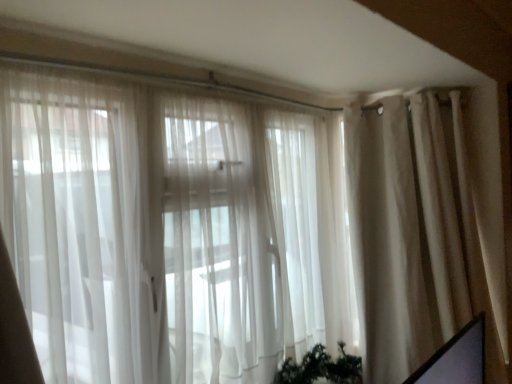
Question: From the image's perspective, does beige fabric curtain at right appear higher than matte black screen at lower right?

Choices:
 (A) yes
 (B) no

Answer: (A)

Question: Can you confirm if beige fabric curtain at right is positioned to the left of matte black screen at lower right?

Choices:
 (A) yes
 (B) no

Answer: (B)

Question: Does beige fabric curtain at right have a greater height compared to matte black screen at lower right?

Choices:
 (A) no
 (B) yes

Answer: (B)

Question: Can you confirm if beige fabric curtain at right is thinner than matte black screen at lower right?

Choices:
 (A) yes
 (B) no

Answer: (B)

Question: Does beige fabric curtain at right come behind matte black screen at lower right?

Choices:
 (A) no
 (B) yes

Answer: (B)

Question: Is beige fabric curtain at right directly adjacent to matte black screen at lower right?

Choices:
 (A) no
 (B) yes

Answer: (A)

Question: Is matte black screen at lower right in front of beige fabric curtain at right?

Choices:
 (A) yes
 (B) no

Answer: (A)

Question: Is matte black screen at lower right surrounding beige fabric curtain at right?

Choices:
 (A) yes
 (B) no

Answer: (B)

Question: Considering the relative positions of matte black screen at lower right and beige fabric curtain at right in the image provided, is matte black screen at lower right to the right of beige fabric curtain at right from the viewer's perspective?

Choices:
 (A) no
 (B) yes

Answer: (A)

Question: Does matte black screen at lower right have a smaller size compared to beige fabric curtain at right?

Choices:
 (A) no
 (B) yes

Answer: (B)

Question: Is matte black screen at lower right facing towards beige fabric curtain at right?

Choices:
 (A) yes
 (B) no

Answer: (B)

Question: Can you confirm if matte black screen at lower right is thinner than beige fabric curtain at right?

Choices:
 (A) yes
 (B) no

Answer: (A)

Question: In the image, is matte black screen at lower right on the left side or the right side of beige fabric curtain at right?

Choices:
 (A) left
 (B) right

Answer: (A)